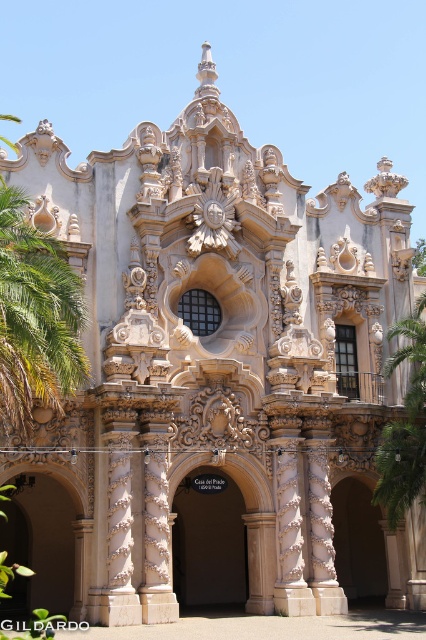
You are standing in front of the grand Baroque structure and want to take a photo. You notice two points marked on the facade. The first point is at coordinate point [218,584] and the second is at point [412,468]. Which point is closer to your camera lens?

Point [218,584] is closer to the camera lens because it is further to the camera than point [412,468].

You are standing in front of the grand entrance and want to walk towards the green leafy palm tree at left and the green leafy palm tree at right. Which direction should you turn to reach each one first?

To reach the green leafy palm tree at left first, turn left. To reach the green leafy palm tree at right first, turn right, since the green leafy palm tree at left is to the left of green leafy palm tree at right.